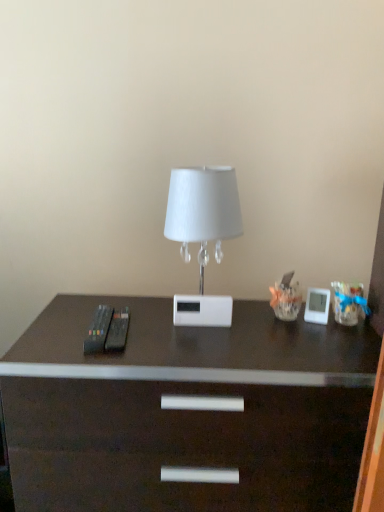
Where is `empty space that is ontop of dark wood desk at center (from a real-world perspective)`? The image size is (384, 512). empty space that is ontop of dark wood desk at center (from a real-world perspective) is located at coordinates (196, 327).